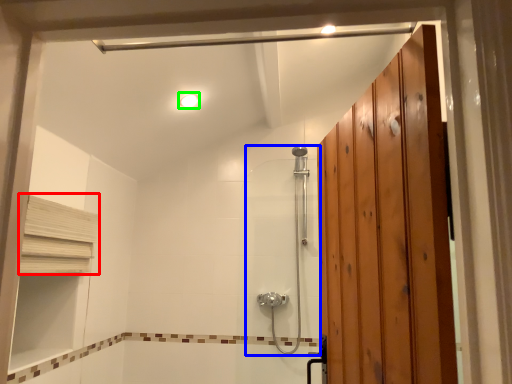
Question: Considering the real-world distances, which object is closest to shelf (highlighted by a red box)? shower door (highlighted by a blue box) or light fixture (highlighted by a green box).

Choices:
 (A) shower door
 (B) light fixture

Answer: (B)